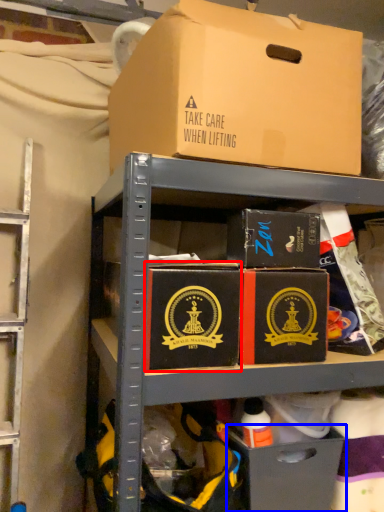
Question: Among these objects, which one is farthest to the camera, box (highlighted by a red box) or drawer (highlighted by a blue box)?

Choices:
 (A) box
 (B) drawer

Answer: (B)